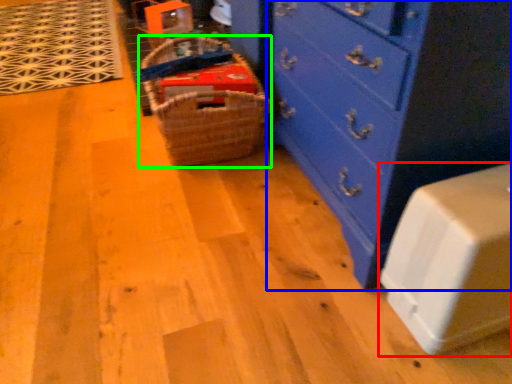
Question: Estimate the real-world distances between objects in this image. Which object is farther from cabinetry (highlighted by a red box), chest of drawers (highlighted by a blue box) or basket (highlighted by a green box)?

Choices:
 (A) chest of drawers
 (B) basket

Answer: (B)